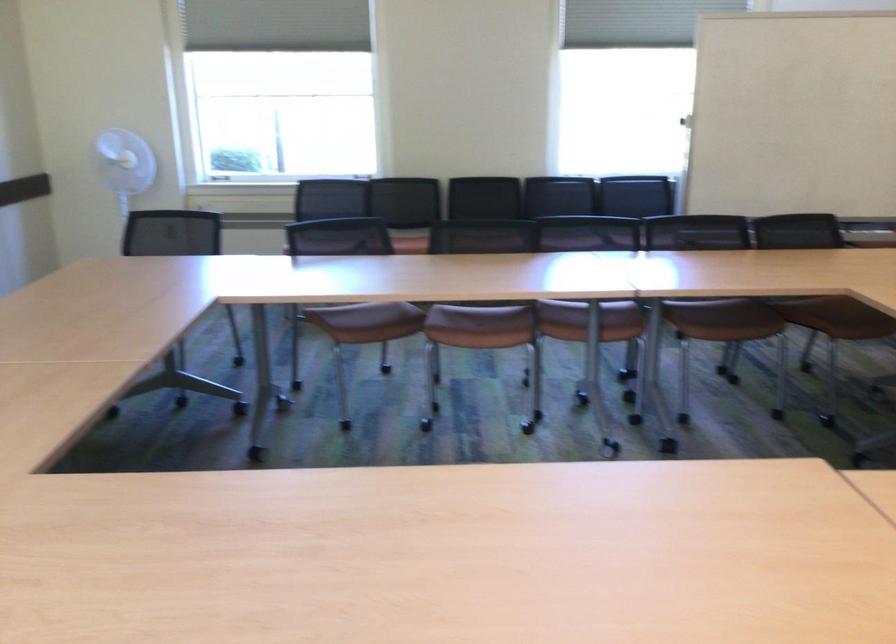
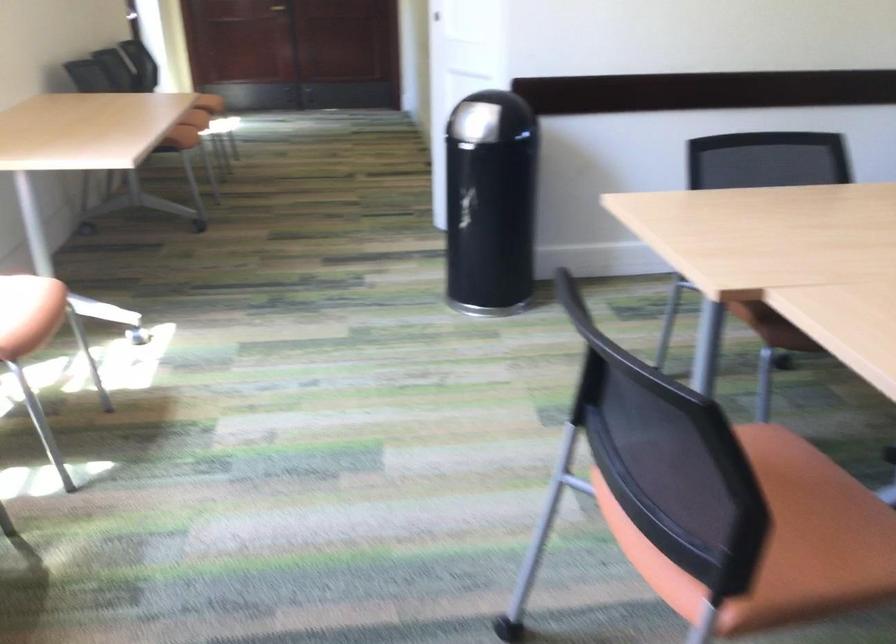
The images are taken continuously from a first-person perspective. In which direction is your viewpoint rotating?

The rotation direction of the camera is left-down.